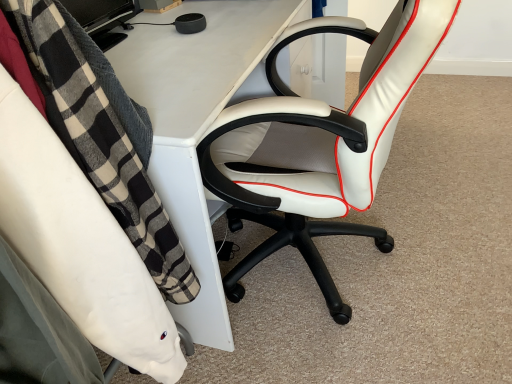
Where is `free space above white plastic desk at center (from a real-world perspective)`? free space above white plastic desk at center (from a real-world perspective) is located at coordinates (185, 37).